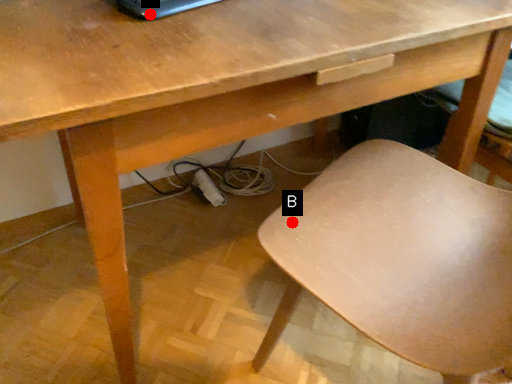
Question: Two points are circled on the image, labeled by A and B beside each circle. Which point appears closest to the camera in this image?

Choices:
 (A) A is closer
 (B) B is closer

Answer: (A)